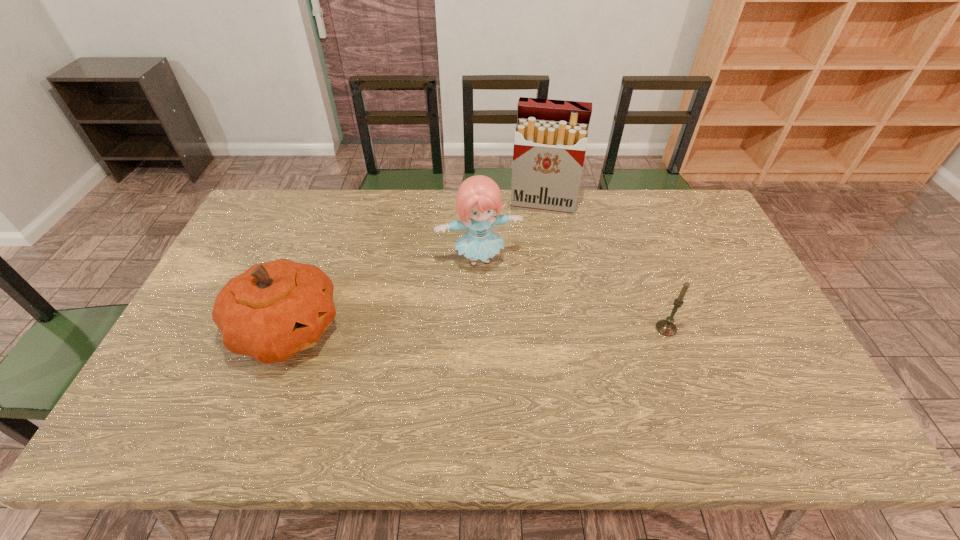
At what (x,y) coordinates should I click in order to perform the action: click on vacant space at the far edge. Please return your answer as a coordinate pair (x, y). Image resolution: width=960 pixels, height=540 pixels. Looking at the image, I should click on tap(330, 210).

This screenshot has height=540, width=960. Identify the location of blank space at the left edge of the desktop. (226, 359).

In the image, there is a desktop. Identify the location of free space at the right edge. (702, 258).

Identify the location of vacant area at the near right corner of the desktop. (746, 379).

Locate an element on the screen. Image resolution: width=960 pixels, height=540 pixels. free space that is in between the farthest object and the candle is located at coordinates (605, 266).

Identify the location of vacant space that is in between the tallest object and the doll. The height and width of the screenshot is (540, 960). (511, 232).

Image resolution: width=960 pixels, height=540 pixels. Find the location of `free point between the pumpkin and the third nearest object`. free point between the pumpkin and the third nearest object is located at coordinates (383, 295).

Find the location of a particular element. This screenshot has width=960, height=540. free space between the shortest object and the second tallest object is located at coordinates (572, 294).

This screenshot has height=540, width=960. I want to click on vacant space that's between the cigarette case and the third tallest object, so click(x=415, y=267).

Locate an element on the screen. blank region between the doll and the third tallest object is located at coordinates (383, 295).